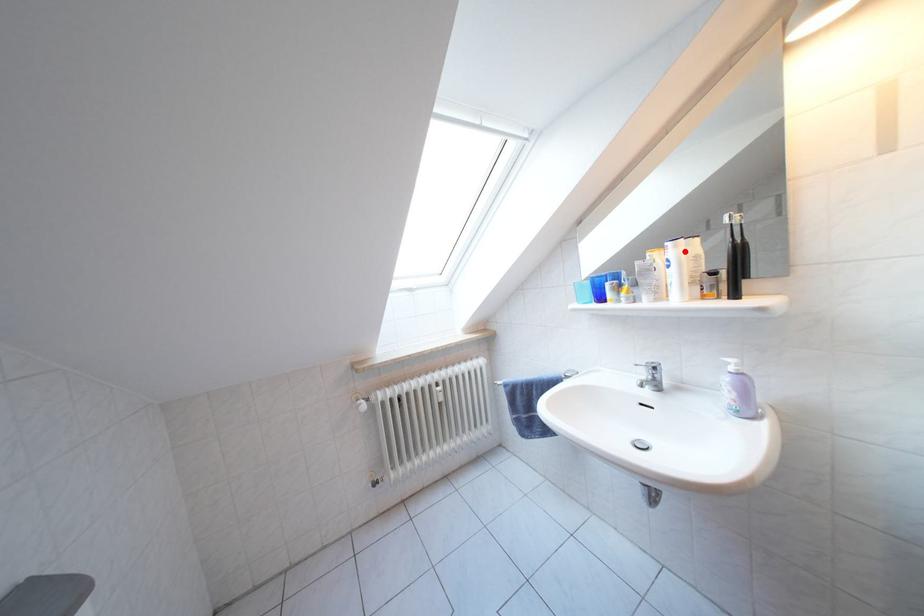
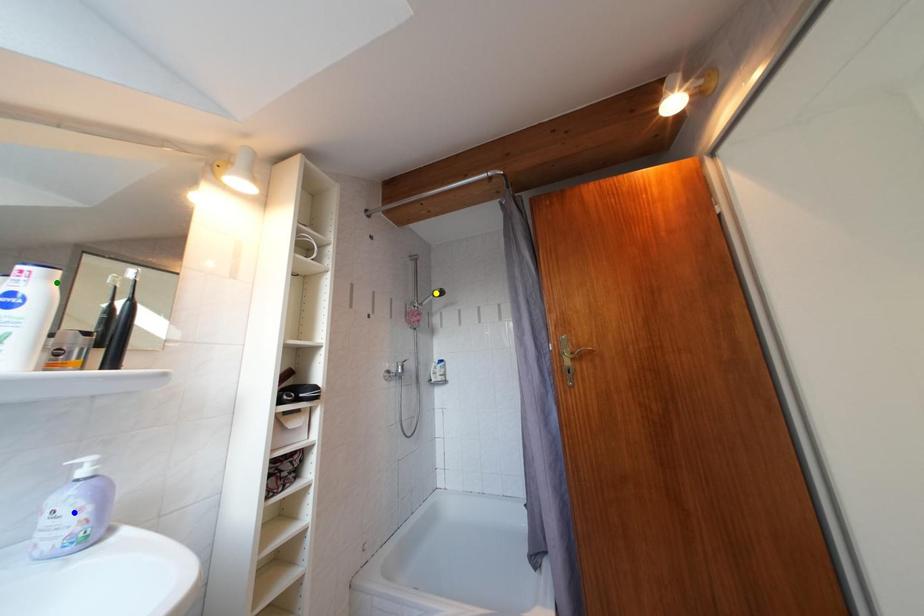
Question: I am providing you with two images of the same scene from different viewpoints. A red point is marked on the first image. You are given multiple points on the second image. Can you choose the point in image 2 that corresponds to the point in image 1?

Choices:
 (A) yellow point
 (B) blue point
 (C) green point

Answer: (C)